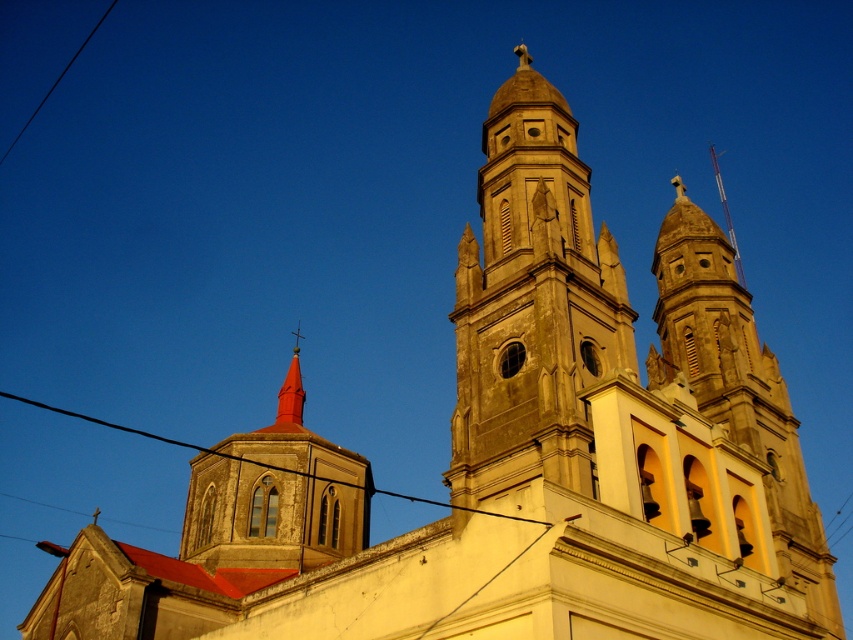
Between light beige stone tower at center and black wire at upper center, which one appears on the right side from the viewer's perspective?

From the viewer's perspective, light beige stone tower at center appears more on the right side.

I want to click on light beige stone tower at center, so click(x=532, y=304).

Image resolution: width=853 pixels, height=640 pixels. I want to click on light beige stone tower at center, so click(x=532, y=304).

How distant is smooth stone steeple at upper left from black wire at upper center?

12.90 meters

Does smooth stone steeple at upper left have a greater height compared to black wire at upper center?

No, smooth stone steeple at upper left is not taller than black wire at upper center.

Does point (291, 435) come farther from viewer compared to point (352, 486)?

No, it is not.

The height and width of the screenshot is (640, 853). What are the coordinates of `smooth stone steeple at upper left` in the screenshot? It's located at (276, 496).

In the scene shown: Which is below, light beige stone tower at center or smooth red spire at center?

smooth red spire at center is lower down.

Can you confirm if light beige stone tower at center is positioned below smooth red spire at center?

Actually, light beige stone tower at center is above smooth red spire at center.

Who is more forward, (x=534, y=461) or (x=277, y=406)?

Point (x=534, y=461) is in front.

Find the location of a particular element. Image resolution: width=853 pixels, height=640 pixels. light beige stone tower at center is located at coordinates (532, 304).